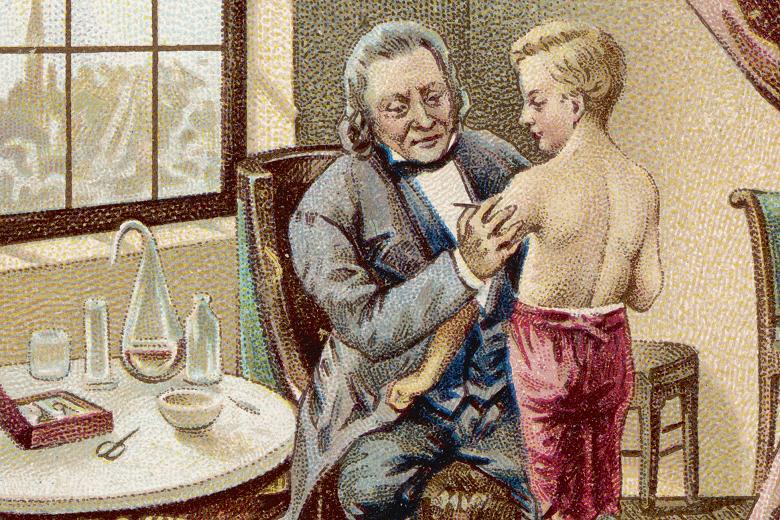
Locate an element on the screen. glass is located at coordinates (48, 354).